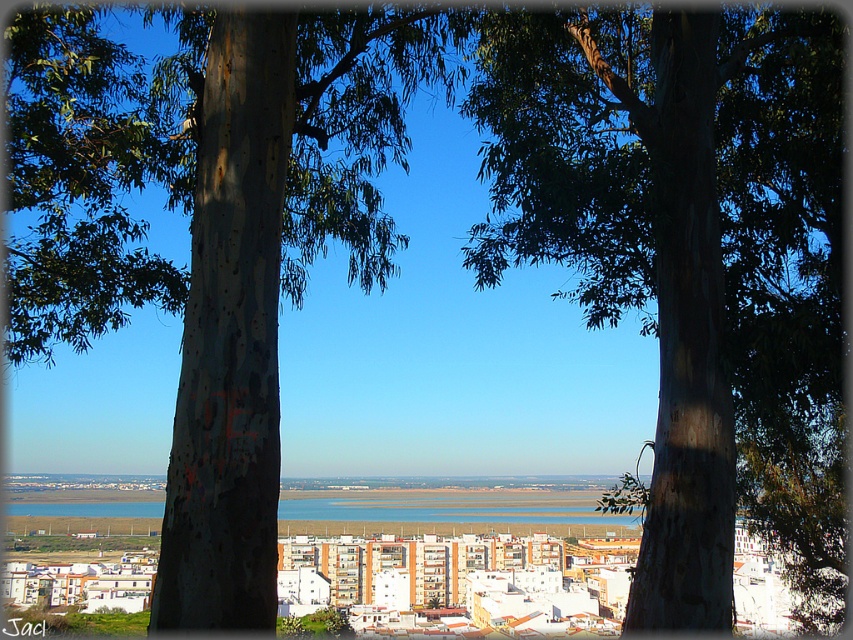
You are standing in a forest clearing and see the brown rough bark tree at center and the blue water at center. Which object is larger in size?

The brown rough bark tree at center is bigger than the blue water at center.

You are standing in the scenic view between two tree trunks. You see two points marked as point 1 at coordinates point (154, 124) and point 2 at coordinates point (424, 508). Which point is closer to you?

Point (154, 124) is in front of point (424, 508), so point (154, 124) is closer to you.